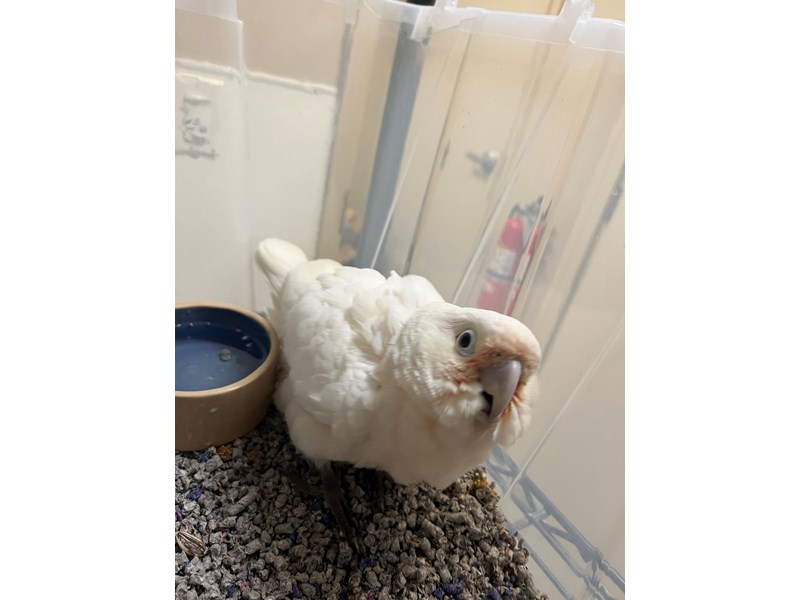
The height and width of the screenshot is (600, 800). In order to click on door in this screenshot , I will do `click(497, 102)`.